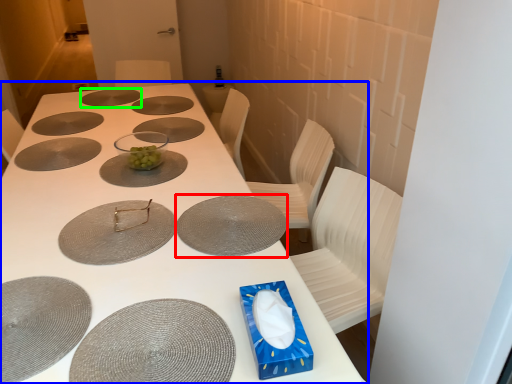
Question: Which object is the closest to the glass plate (highlighted by a red box)? Choose among these: table (highlighted by a blue box) or glass plate (highlighted by a green box).

Choices:
 (A) table
 (B) glass plate

Answer: (A)